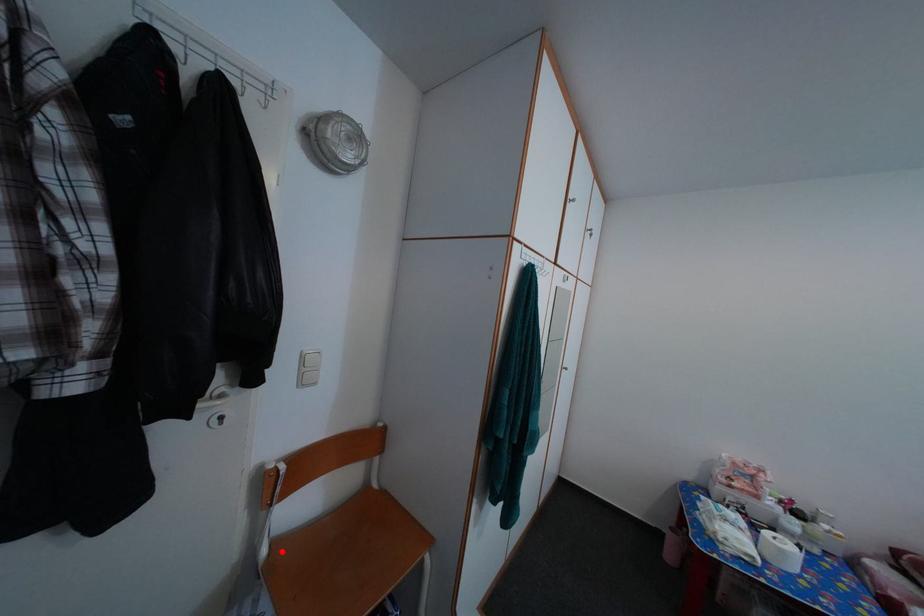
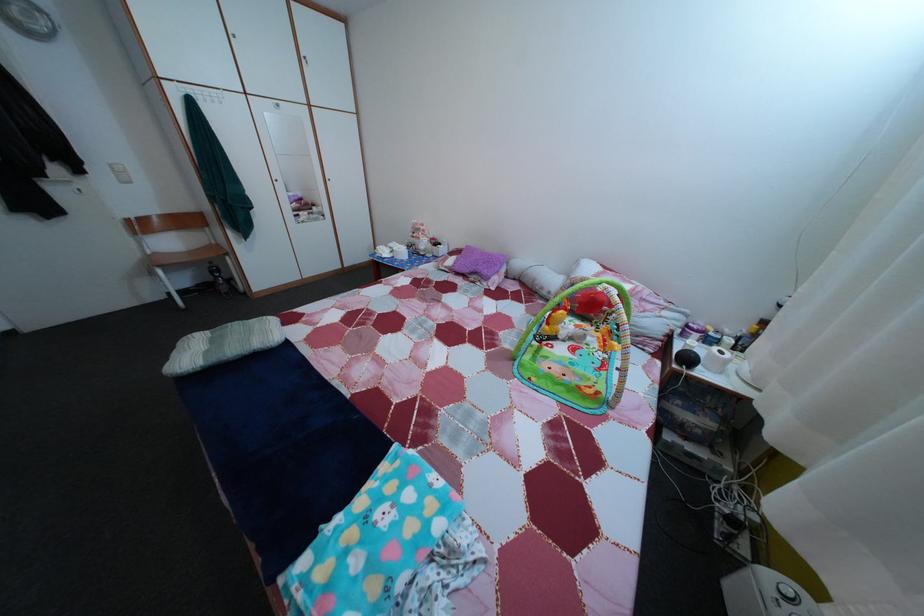
Where in the second image is the point corresponding to the highlighted location from the first image?

(164, 261)